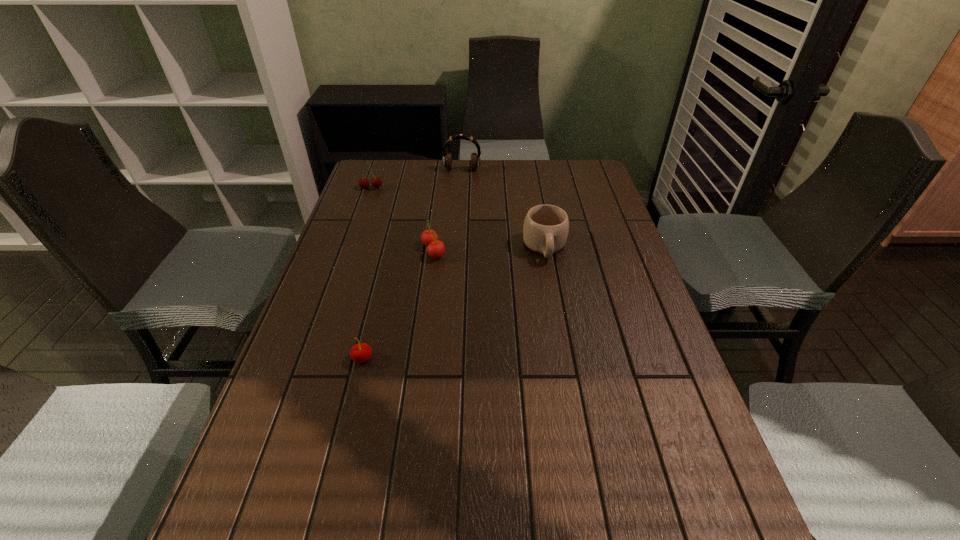
Identify which object is located as the fourth nearest to the leftmost object. Please provide its 2D coordinates. Your answer should be formatted as a tuple, i.e. [(x, y)], where the tuple contains the x and y coordinates of a point satisfying the conditions above.

[(361, 352)]

Choose which object is the fourth nearest neighbor to the rightmost object. Please provide its 2D coordinates. Your answer should be formatted as a tuple, i.e. [(x, y)], where the tuple contains the x and y coordinates of a point satisfying the conditions above.

[(376, 182)]

In order to click on cherry that is the closest one to the second cherry from right to left in this screenshot , I will do `click(435, 248)`.

The height and width of the screenshot is (540, 960). Find the location of `the second closest cherry to the rightmost object`. the second closest cherry to the rightmost object is located at coordinates (361, 352).

You are a GUI agent. You are given a task and a screenshot of the screen. Output one action in this format:
    pyautogui.click(x=<x>, y=<y>)
    Task: Click on the vacant space that satisfies the following two spatial constraints: 1. on the surface of the nearest object; 2. on the right side of the farthest cherry
    
    Given the screenshot: What is the action you would take?
    pyautogui.click(x=311, y=359)

What are the coordinates of `vacant region that satisfies the following two spatial constraints: 1. on the surface of the second farthest cherry; 2. on the left side of the leftmost cherry` in the screenshot? It's located at (348, 251).